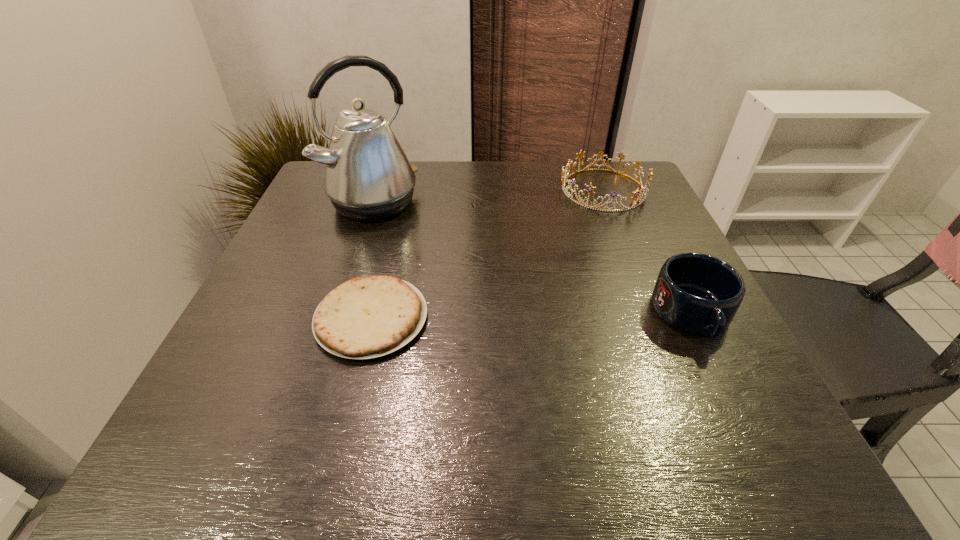
Identify the location of vacant space that satisfies the following two spatial constraints: 1. on the front side of the kettle; 2. on the right side of the tortilla. (335, 318).